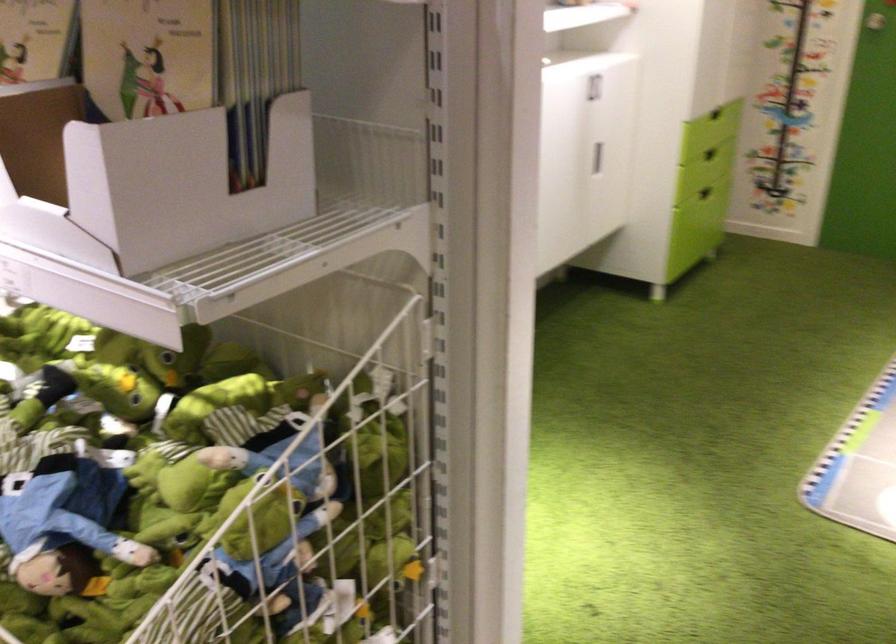
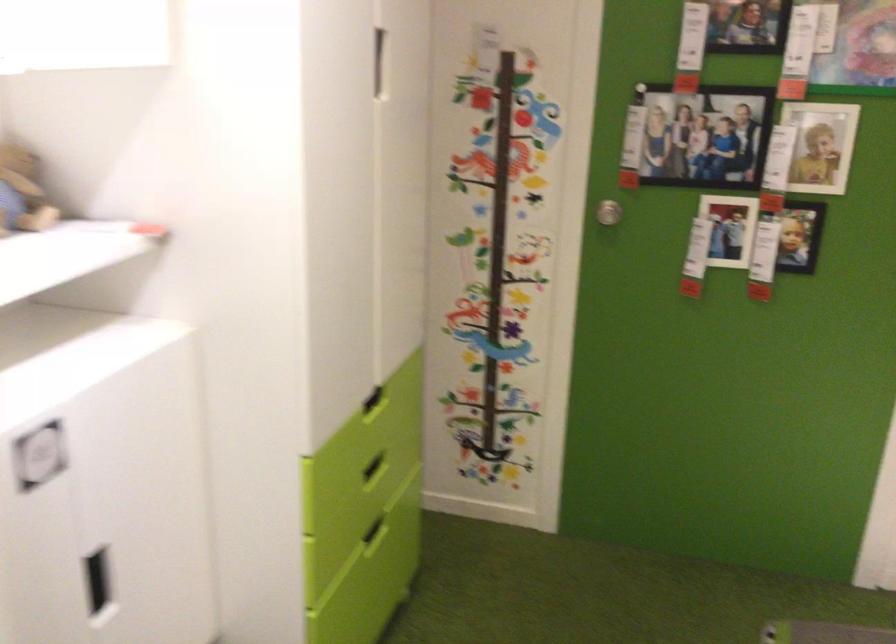
Which direction would the cameraman need to move to produce the second image?

The cameraman walked toward right, forward.